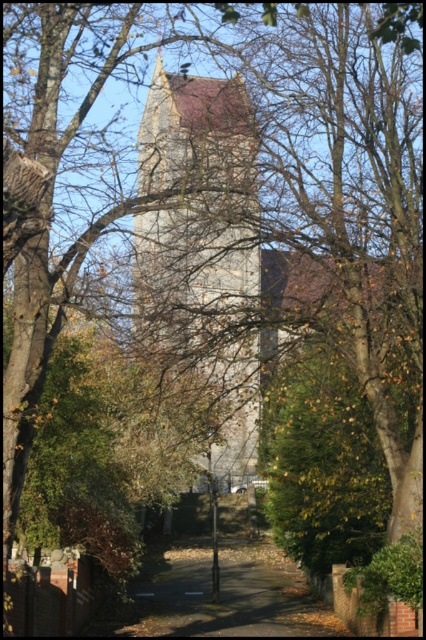
Consider the image. You are standing at the entrance of the pathway leading to the stone tower at center. If you were to walk straight towards the tower, would you need to adjust your direction to the left or right to reach it?

Since the stone tower at center is positioned at point (203, 248), which is the central area of the image, walking straight towards it would be the correct path without needing to adjust direction to the left or right.

You are standing at the base of the historic stone tower and notice two points marked on the ground. The first point is at coordinate point(207,83) and the second is at point(201,550). If you were to walk from the tower towards the pathway, which point would you encounter first?

Point(207,83) is in front of point(201,550), so you would encounter point(207,83) first when walking from the tower towards the pathway.